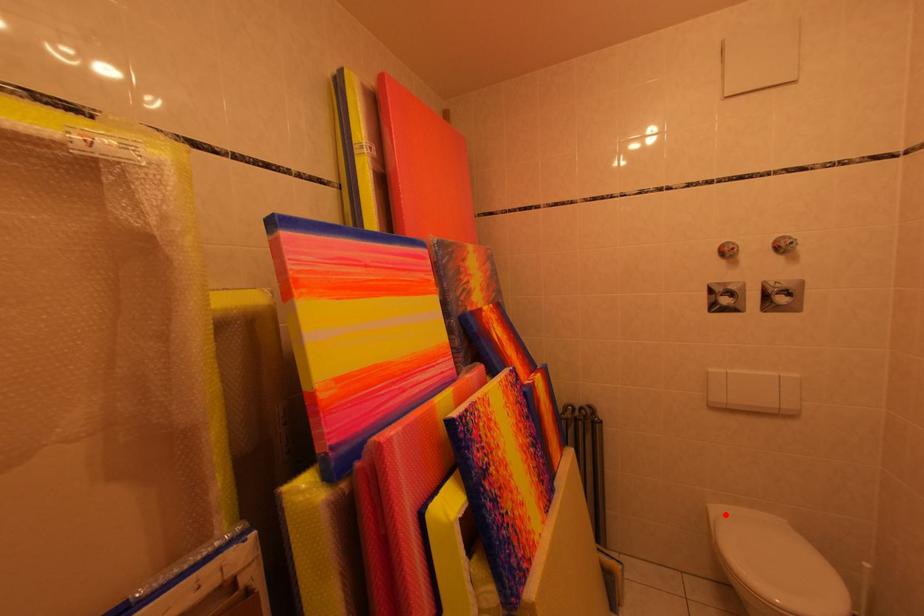
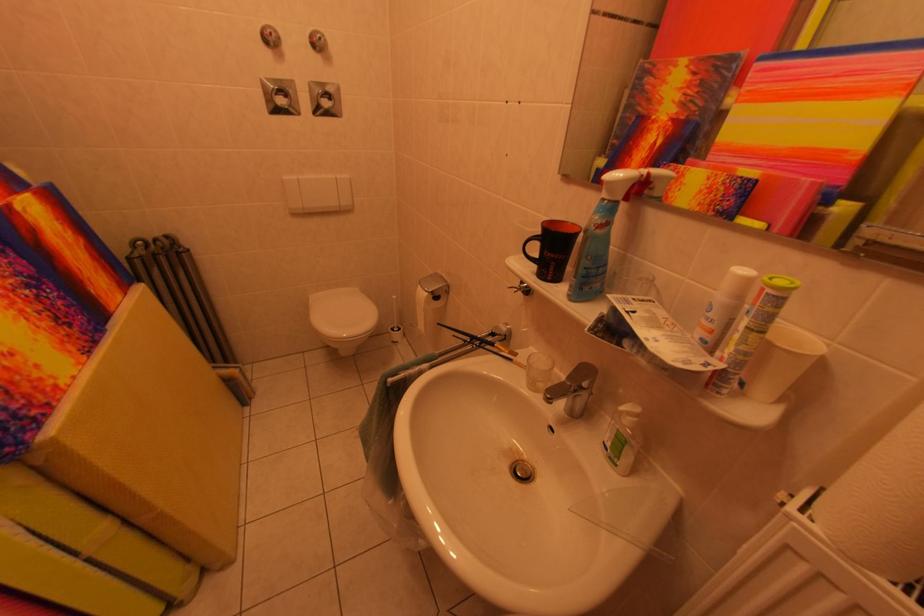
The point at the highlighted location is marked in the first image. Where is the corresponding point in the second image?

(322, 301)